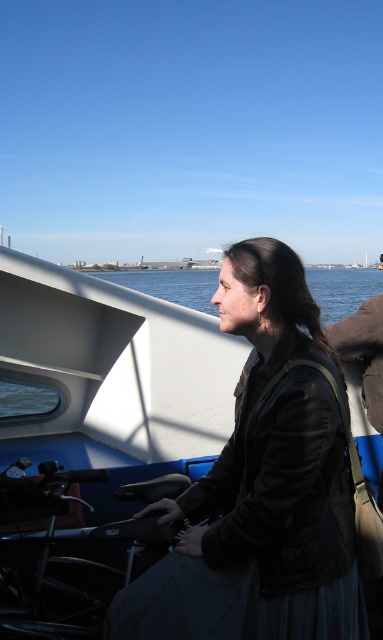
You are standing on the shore and see the white matte boat at center and the blue water at upper center. Which object is closer to your left side?

The white matte boat at center is to the left of blue water at upper center, so the white matte boat at center is closer to your left side.